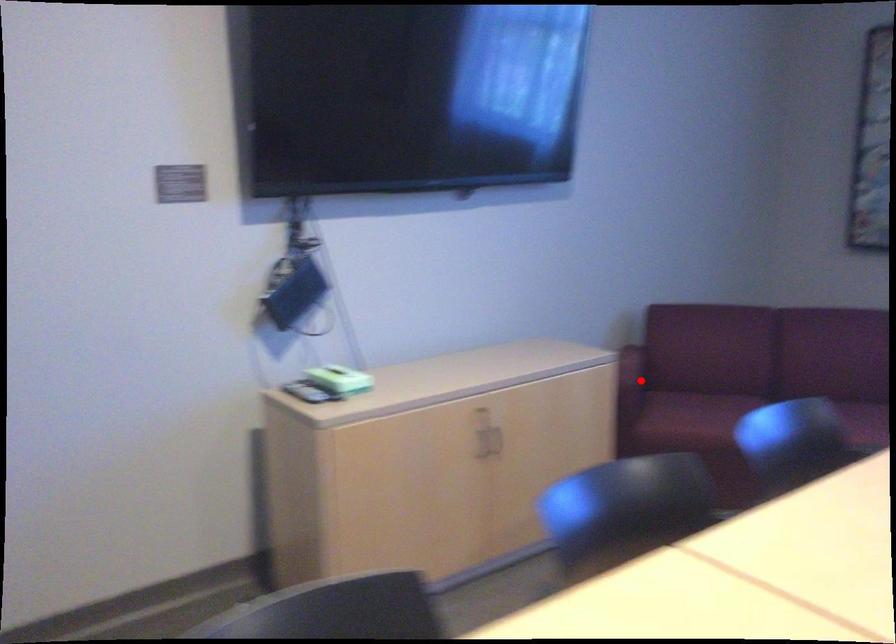
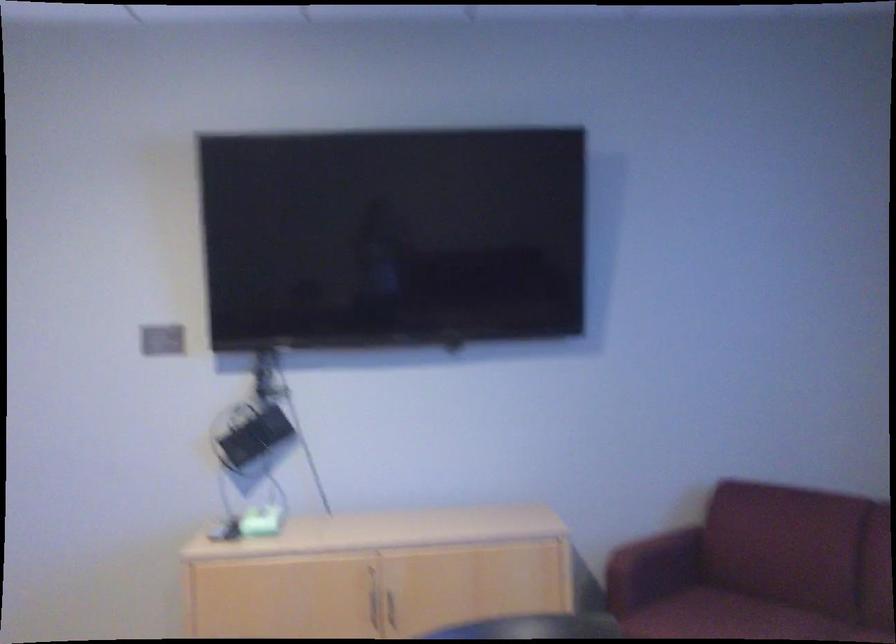
The point at the highlighted location is marked in the first image. Where is the corresponding point in the second image?

(652, 567)